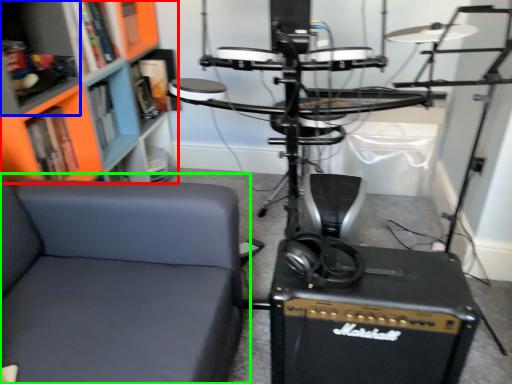
Question: Considering the real-world distances, which object is closest to bookcase (highlighted by a red box)? shelf (highlighted by a blue box) or chair (highlighted by a green box).

Choices:
 (A) shelf
 (B) chair

Answer: (A)